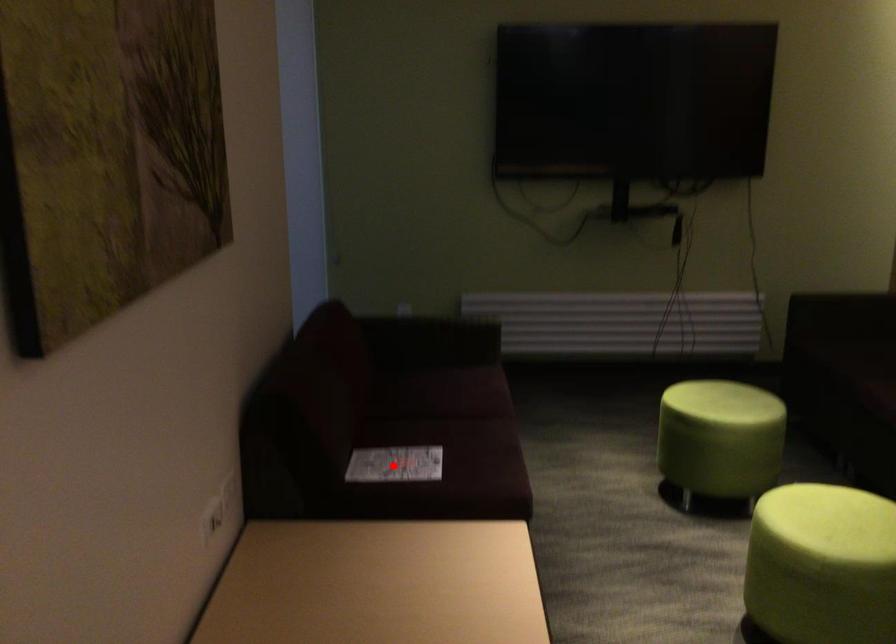
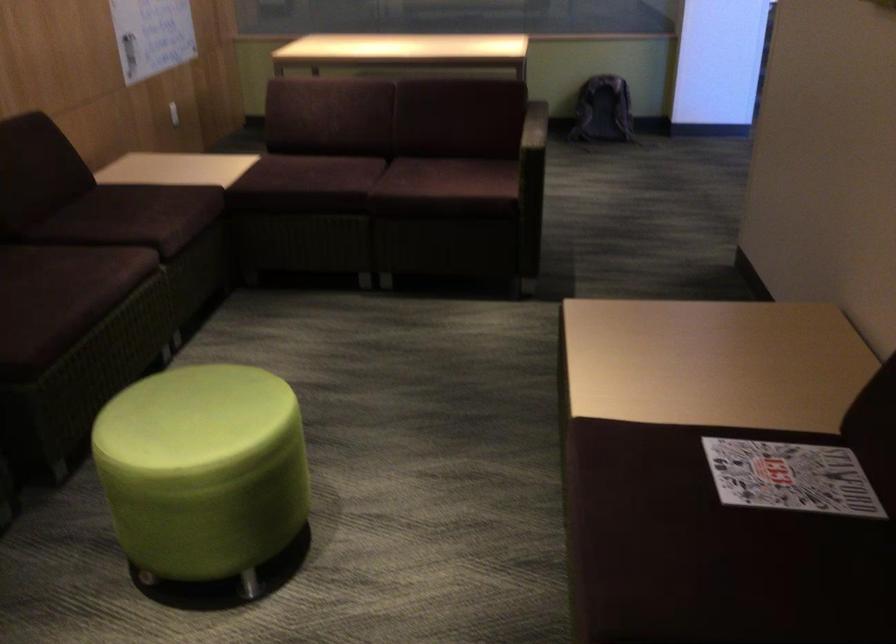
Question: I am providing you with two images of the same scene from different viewpoints. Given a red point in image1, look at the same physical point in image2. Is it:

Choices:
 (A) Closer to the viewpoint
 (B) Farther from the viewpoint

Answer: (A)